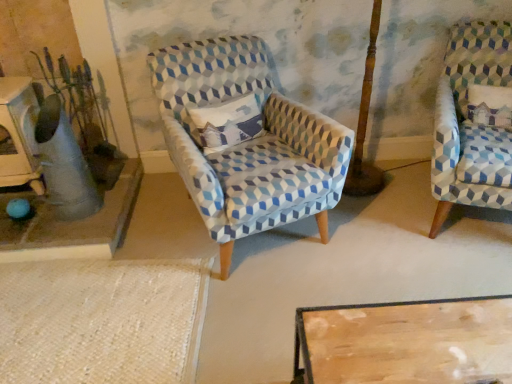
Question: Is blue patterned fabric chair at center, the 2th chair positioned from the right, closer to the viewer compared to matte gray vase at left?

Choices:
 (A) yes
 (B) no

Answer: (A)

Question: Could matte gray vase at left be considered to be inside blue patterned fabric chair at center, the 2th chair positioned from the right?

Choices:
 (A) no
 (B) yes

Answer: (A)

Question: Is blue patterned fabric chair at center, the 2th chair positioned from the right, shorter than matte gray vase at left?

Choices:
 (A) no
 (B) yes

Answer: (A)

Question: Is blue patterned fabric chair at center, the 2th chair positioned from the right, not close to matte gray vase at left?

Choices:
 (A) no
 (B) yes

Answer: (A)

Question: Is blue patterned fabric chair at center, the 2th chair positioned from the right, with matte gray vase at left?

Choices:
 (A) yes
 (B) no

Answer: (B)

Question: Is blue patterned fabric chair at center, acting as the 1th chair starting from the left, smaller than matte gray vase at left?

Choices:
 (A) no
 (B) yes

Answer: (A)

Question: Considering the relative sizes of blue patterned fabric chair at center, acting as the 1th chair starting from the left, and blue-patterned fabric chair at right, positioned as the first chair in right-to-left order, in the image provided, is blue patterned fabric chair at center, acting as the 1th chair starting from the left, thinner than blue-patterned fabric chair at right, positioned as the first chair in right-to-left order,?

Choices:
 (A) yes
 (B) no

Answer: (B)

Question: Is there a large distance between blue patterned fabric chair at center, acting as the 1th chair starting from the left, and blue-patterned fabric chair at right, which is counted as the 2th chair, starting from the left?

Choices:
 (A) yes
 (B) no

Answer: (B)

Question: Is blue patterned fabric chair at center, acting as the 1th chair starting from the left, bigger than blue-patterned fabric chair at right, positioned as the first chair in right-to-left order?

Choices:
 (A) no
 (B) yes

Answer: (B)

Question: From a real-world perspective, does blue patterned fabric chair at center, acting as the 1th chair starting from the left, sit lower than blue-patterned fabric chair at right, positioned as the first chair in right-to-left order?

Choices:
 (A) no
 (B) yes

Answer: (B)

Question: Is blue patterned fabric chair at center, acting as the 1th chair starting from the left, positioned with its back to blue-patterned fabric chair at right, which is counted as the 2th chair, starting from the left?

Choices:
 (A) no
 (B) yes

Answer: (A)

Question: Can you confirm if blue patterned fabric chair at center, acting as the 1th chair starting from the left, is smaller than blue-patterned fabric chair at right, positioned as the first chair in right-to-left order?

Choices:
 (A) no
 (B) yes

Answer: (A)

Question: Would you say matte gray vase at left contains blue patterned fabric chair at center, the 2th chair positioned from the right?

Choices:
 (A) no
 (B) yes

Answer: (A)